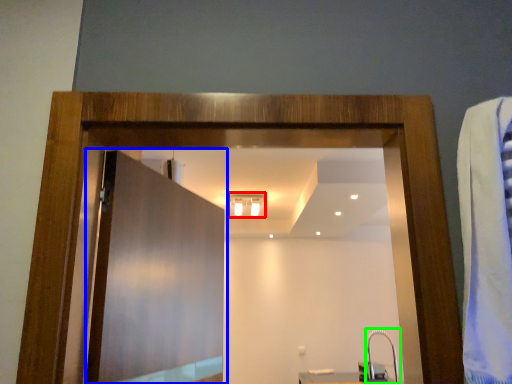
Question: Considering the real-world distances, which object is closest to light fixture (highlighted by a red box)? door (highlighted by a blue box) or faucet (highlighted by a green box).

Choices:
 (A) door
 (B) faucet

Answer: (B)